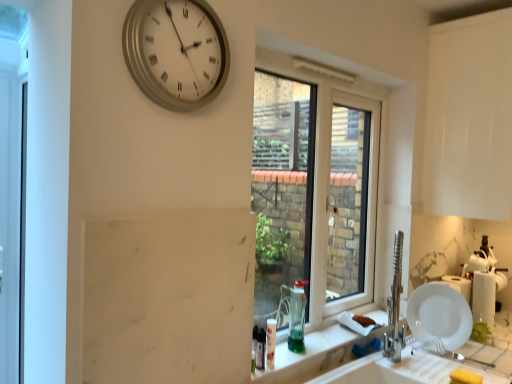
In the scene shown: In order to face green glass at lower center, should I rotate leftwards or rightwards?

You should rotate right by 10.153 degrees.

At what (x,y) coordinates should I click in order to perform the action: click on silver metallic clock at upper center. Please return your answer as a coordinate pair (x, y). This screenshot has width=512, height=384. Looking at the image, I should click on (176, 52).

You are a GUI agent. You are given a task and a screenshot of the screen. Output one action in this format:
    pyautogui.click(x=<x>, y=<y>)
    Task: Click on the wall clock that is in front of the green glass bottle at window
    Image resolution: width=512 pixels, height=384 pixels.
    Given the screenshot: What is the action you would take?
    pyautogui.click(x=176, y=52)

From the picture: Between silver metallic clock at upper center and green glass bottle at window, which one appears on the left side from the viewer's perspective?

Positioned to the left is silver metallic clock at upper center.

Is silver metallic clock at upper center positioned far away from green glass bottle at window?

Yes, silver metallic clock at upper center is far from green glass bottle at window.

Can you tell me how much silver metallic clock at upper center and green glass bottle at window differ in facing direction?

There is a 0.478-degree angle between the facing directions of silver metallic clock at upper center and green glass bottle at window.

The image size is (512, 384). Identify the location of window sill on the left side of yellow sponge at lower right. (319, 351).

How many degrees apart are the facing directions of green glass at lower center and yellow sponge at lower right?

green glass at lower center and yellow sponge at lower right are facing 8.86 degrees away from each other.

Which is more to the left, green glass at lower center or yellow sponge at lower right?

green glass at lower center is more to the left.

From a real-world perspective, is green glass at lower center positioned under yellow sponge at lower right based on gravity?

No, from a real-world perspective, green glass at lower center is not under yellow sponge at lower right.

From the image's perspective, is green glass at lower center above or below green glass bottle at window?

From the image's perspective, green glass at lower center appears below green glass bottle at window.

Image resolution: width=512 pixels, height=384 pixels. Identify the location of window sill located underneath the green glass bottle at window (from a real-world perspective). (319, 351).

Can green glass bottle at window be found inside green glass at lower center?

No, green glass bottle at window is not a part of green glass at lower center.

Are green glass at lower center and green glass bottle at window making contact?

green glass at lower center and green glass bottle at window are clearly separated.

Which is in front, white plastic window at center or green glass bottle at window?

white plastic window at center is closer to the camera.

What's the angular difference between white plastic window at center and green glass bottle at window's facing directions?

1.04 degrees.

From the image's perspective, is white plastic window at center under green glass bottle at window?

No, from the image's perspective, white plastic window at center is not beneath green glass bottle at window.

Who is bigger, white plastic window at center or green glass bottle at window?

white plastic window at center.

Considering the sizes of objects white glossy plate at lower right and yellow sponge at lower right in the image provided, who is smaller, white glossy plate at lower right or yellow sponge at lower right?

yellow sponge at lower right is smaller.

Between white glossy plate at lower right and yellow sponge at lower right, which one has less height?

With less height is yellow sponge at lower right.

From a real-world perspective, which object rests below the other?

yellow sponge at lower right is physically lower.

Identify the location of soap on the left of white glossy plate at lower right. The image size is (512, 384). (464, 377).

Is point (294, 315) closer or farther from the camera than point (170, 57)?

Point (294, 315).

Could silver metallic clock at upper center be considered to be inside green glass bottle at window?

No, silver metallic clock at upper center is not surrounded by green glass bottle at window.

Would you say green glass bottle at window is a long distance from silver metallic clock at upper center?

Absolutely, green glass bottle at window is distant from silver metallic clock at upper center.

Is white glossy plate at lower right a part of yellow sponge at lower right?

Actually, white glossy plate at lower right is outside yellow sponge at lower right.

Is white glossy plate at lower right at the back of yellow sponge at lower right?

No, yellow sponge at lower right is not facing away from white glossy plate at lower right.

Find the location of `plate on the right of yellow sponge at lower right`. plate on the right of yellow sponge at lower right is located at coordinates (439, 315).

Who is taller, yellow sponge at lower right or white glossy plate at lower right?

white glossy plate at lower right.

Find the location of a particular element. The width and height of the screenshot is (512, 384). wall clock above the green glass bottle at window (from the image's perspective) is located at coordinates (176, 52).

Locate an element on the screen. window sill located on the left of yellow sponge at lower right is located at coordinates (319, 351).

Estimate the real-world distances between objects in this image. Which object is closer to green glass at lower center, green glass bottle at window or white glossy plate at lower right?

green glass bottle at window lies closer to green glass at lower center than the other object.

Which object lies nearer to the anchor point yellow sponge at lower right, green glass at lower center or silver metallic clock at upper center?

green glass at lower center is positioned closer to the anchor yellow sponge at lower right.

Estimate the real-world distances between objects in this image. Which object is closer to green glass bottle at window, silver metallic clock at upper center or white plastic window at center?

silver metallic clock at upper center is positioned closer to the anchor green glass bottle at window.

From the image, which object appears to be farther from silver metallic clock at upper center, white glossy plate at lower right or yellow sponge at lower right?

yellow sponge at lower right is positioned further to the anchor silver metallic clock at upper center.

Estimate the real-world distances between objects in this image. Which object is closer to white plastic window at center, green glass bottle at window or yellow sponge at lower right?

The object closer to white plastic window at center is green glass bottle at window.

Based on their spatial positions, is white glossy plate at lower right or yellow sponge at lower right closer to white plastic window at center?

white glossy plate at lower right is closer to white plastic window at center.

From the picture: When comparing their distances from green glass bottle at window, does white plastic window at center or green glass at lower center seem further?

white plastic window at center is positioned further to the anchor green glass bottle at window.

When comparing their distances from silver metallic clock at upper center, does white glossy plate at lower right or green glass at lower center seem closer?

green glass at lower center is closer to silver metallic clock at upper center.

I want to click on window located between green glass bottle at window and white glossy plate at lower right in the left-right direction, so click(314, 190).

At what (x,y) coordinates should I click in order to perform the action: click on bottle that lies between white plastic window at center and yellow sponge at lower right from top to bottom. Please return your answer as a coordinate pair (x, y). The height and width of the screenshot is (384, 512). Looking at the image, I should click on (297, 317).

At what (x,y) coordinates should I click in order to perform the action: click on window sill between white plastic window at center and yellow sponge at lower right from top to bottom. Please return your answer as a coordinate pair (x, y). The width and height of the screenshot is (512, 384). Looking at the image, I should click on (319, 351).

The height and width of the screenshot is (384, 512). In order to click on window between silver metallic clock at upper center and green glass bottle at window in the vertical direction in this screenshot , I will do `click(314, 190)`.